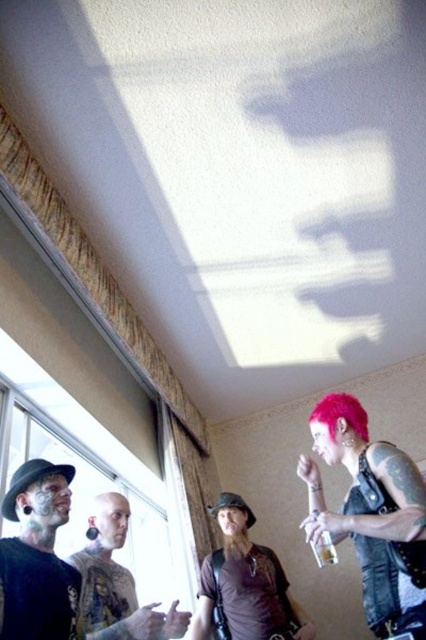
You are an interior designer analyzing the room layout. You notice the black leather hat at left and the pink matte hair at upper right. Which object has a taller height?

The black leather hat at left has a greater height compared to the pink matte hair at upper right.

You are an interior designer assessing the room layout. You notice the black leather hat at left and the pink matte hair at upper right. Which object is closer to you from your current viewpoint?

The black leather hat at left is closer to you because it is positioned in front of the pink matte hair at upper right.

You are an interior designer analyzing the room layout. You notice the black leather hat at left and the pink matte hair at upper right. Which object is positioned higher in the room?

The pink matte hair at upper right is positioned higher in the room than the black leather hat at left.